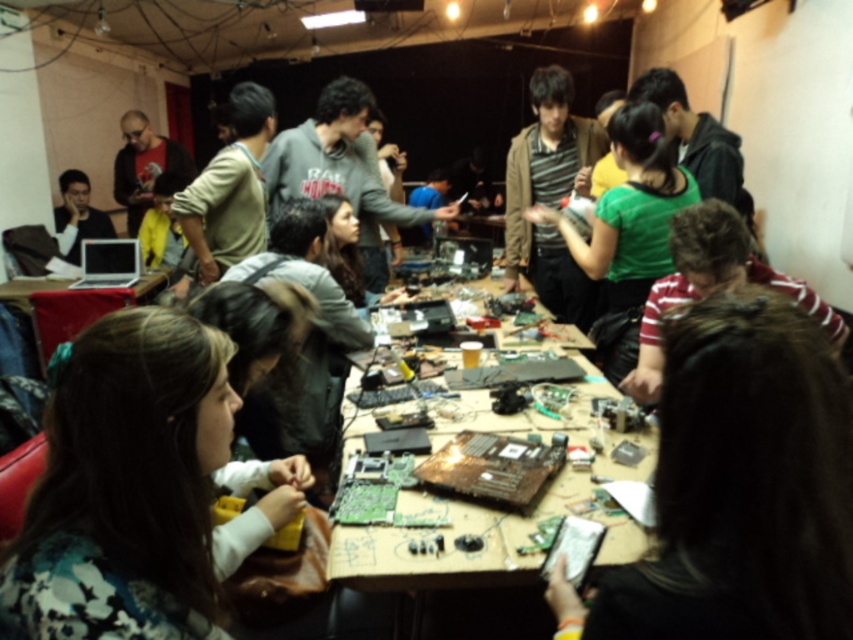
Question: Which of the following is the farthest from the observer?

Choices:
 (A) (134, 400)
 (B) (633, 582)

Answer: (A)

Question: Can you confirm if black matte hair at upper right is positioned to the left of wooden table at center?

Choices:
 (A) no
 (B) yes

Answer: (A)

Question: Does wooden table at center appear on the left side of matte wooden table at center?

Choices:
 (A) no
 (B) yes

Answer: (A)

Question: Which point is farther from the camera taking this photo?

Choices:
 (A) (534, 420)
 (B) (54, 298)
 (C) (68, 547)
 (D) (675, 604)

Answer: (B)

Question: Is floral fabric shirt at lower left positioned at the back of wooden table at center?

Choices:
 (A) yes
 (B) no

Answer: (B)

Question: Estimate the real-world distances between objects in this image. Which object is farther from the floral fabric shirt at lower left?

Choices:
 (A) black matte hair at upper right
 (B) matte wooden table at center
 (C) wooden table at center

Answer: (B)